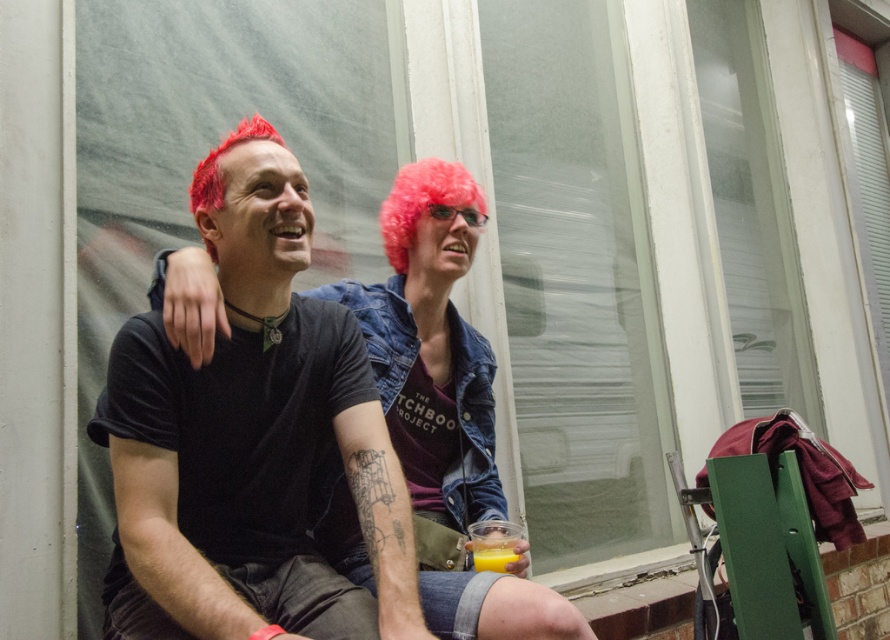
You are a photographer trying to capture a closeup shot of the translucent plastic cup at lower center without the pink synthetic wig at upper center blocking the view. Based on their sizes, can you fit the cup into the frame while avoiding the wig?

The pink synthetic wig at upper center is wider than the translucent plastic cup at lower center, so it might block part of the cup if not positioned carefully. Adjust the angle to ensure the cup is fully visible while minimizing the wig in the frame.